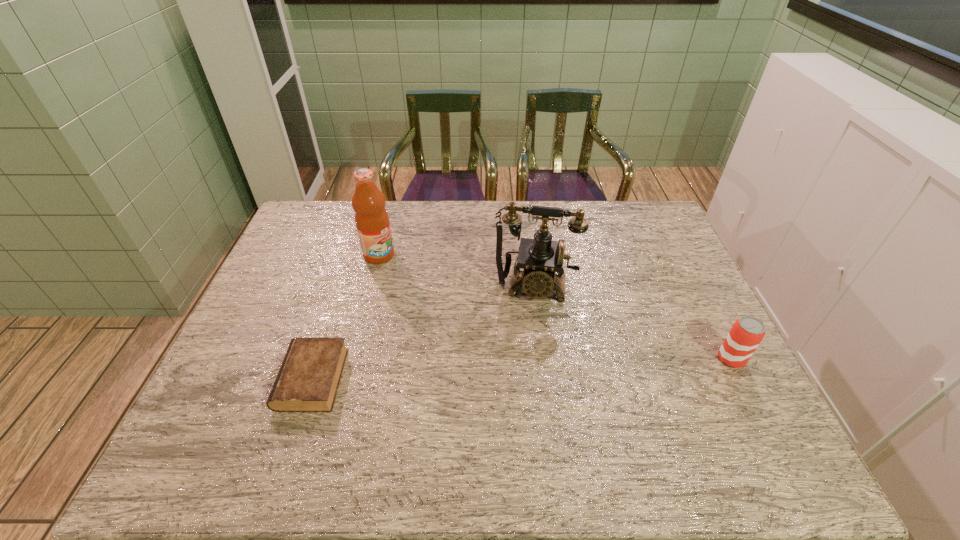
The width and height of the screenshot is (960, 540). In the image, there is a desktop. Find the location of `vacant space at the far right corner`. vacant space at the far right corner is located at coordinates (658, 231).

The height and width of the screenshot is (540, 960). I want to click on free space between the second farthest object and the fruit juice, so click(457, 271).

Where is `unoccupied position between the diary and the second shortest object`? This screenshot has height=540, width=960. unoccupied position between the diary and the second shortest object is located at coordinates (521, 369).

Locate an element on the screen. This screenshot has height=540, width=960. vacant area that lies between the fruit juice and the third nearest object is located at coordinates (457, 271).

Locate an element on the screen. free space between the rightmost object and the telephone is located at coordinates [633, 323].

Where is `vacant space that is in between the rightmost object and the fruit juice`? The height and width of the screenshot is (540, 960). vacant space that is in between the rightmost object and the fruit juice is located at coordinates (555, 307).

The height and width of the screenshot is (540, 960). I want to click on free space between the third tallest object and the telephone, so click(x=633, y=323).

Identify the location of free point between the telephone and the diary. The image size is (960, 540). (423, 333).

You are a GUI agent. You are given a task and a screenshot of the screen. Output one action in this format:
    pyautogui.click(x=<x>, y=<y>)
    Task: Click on the vacant area that lies between the shortest object and the third object from left to right
    This screenshot has width=960, height=540.
    Given the screenshot: What is the action you would take?
    pyautogui.click(x=423, y=333)

This screenshot has height=540, width=960. In order to click on free point between the beer can and the farthest object in this screenshot , I will do `click(555, 307)`.